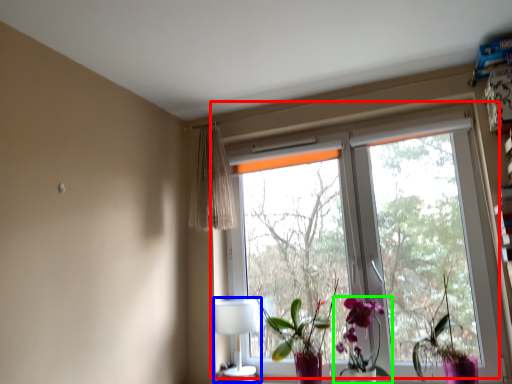
Question: Which object is positioned closest to window (highlighted by a red box)? Select from table lamp (highlighted by a blue box) and houseplant (highlighted by a green box).

Choices:
 (A) table lamp
 (B) houseplant

Answer: (B)